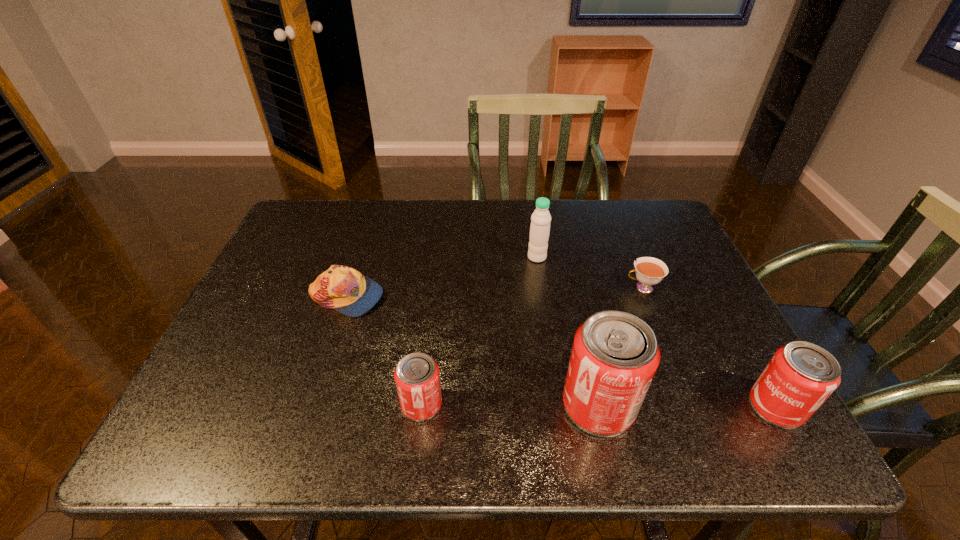
Please point out where to position a new can on the left to maintain spacing. Please provide its 2D coordinates. Your answer should be formatted as a tuple, i.e. [(x, y)], where the tuple contains the x and y coordinates of a point satisfying the conditions above.

[(246, 403)]